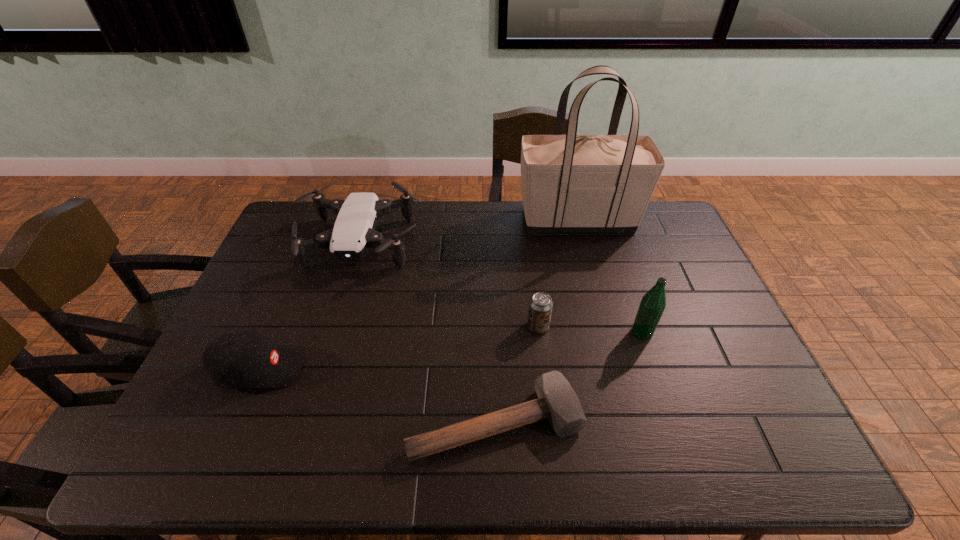
The width and height of the screenshot is (960, 540). I want to click on vacant area between the tallest object and the baseball cap, so click(x=419, y=295).

Image resolution: width=960 pixels, height=540 pixels. Identify the location of vacant point located between the beer can and the tallest object. (558, 274).

This screenshot has width=960, height=540. I want to click on unoccupied position between the drone and the baseball cap, so click(x=309, y=307).

The image size is (960, 540). I want to click on empty space between the shopping bag and the baseball cap, so click(419, 295).

Identify the location of unoccupied position between the drone and the shopping bag. The width and height of the screenshot is (960, 540). (469, 232).

At what (x,y) coordinates should I click in order to perform the action: click on free space between the drone and the baseball cap. Please return your answer as a coordinate pair (x, y). Looking at the image, I should click on (309, 307).

The image size is (960, 540). I want to click on free space that is in between the tallest object and the fifth shortest object, so click(x=610, y=276).

This screenshot has width=960, height=540. I want to click on blank region between the beer can and the second tallest object, so click(x=590, y=330).

This screenshot has height=540, width=960. I want to click on object that is the fifth closest to the second tallest object, so click(x=245, y=358).

Locate an element on the screen. object that ranks as the closest to the tallest object is located at coordinates (354, 232).